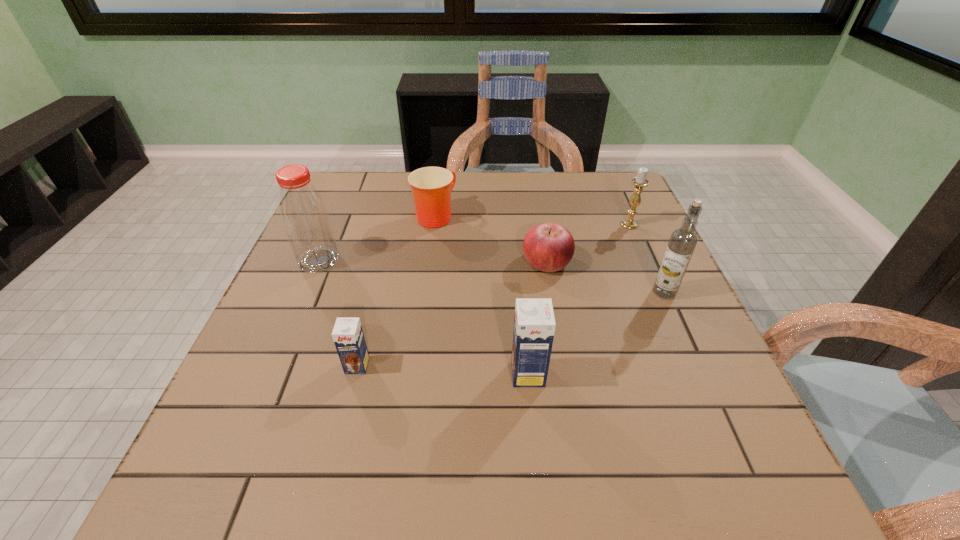
Identify the location of free space located on the front label of the right chocolate milk. (395, 374).

This screenshot has width=960, height=540. In order to click on blank space located 0.290m on the front label of the right chocolate milk in this screenshot , I will do `click(357, 374)`.

I want to click on vacant position located on the right of the fifth object from right to left, so click(536, 215).

The image size is (960, 540). I want to click on vacant space located on the back of the candle holder, so (619, 201).

The width and height of the screenshot is (960, 540). I want to click on free location located on the right of the bottle, so click(x=364, y=260).

Image resolution: width=960 pixels, height=540 pixels. What are the coordinates of `free space located 0.140m on the left of the apple` in the screenshot? It's located at pos(464,262).

Where is `free space located 0.320m on the label of the fifth farthest object`? The height and width of the screenshot is (540, 960). free space located 0.320m on the label of the fifth farthest object is located at coordinates (510, 293).

What are the coordinates of `free space located 0.380m on the label of the fifth farthest object` in the screenshot? It's located at point(483,293).

Where is `free spot located 0.180m on the label of the fifth farthest object`? free spot located 0.180m on the label of the fifth farthest object is located at coordinates (572, 293).

Find the location of a particular element. The width and height of the screenshot is (960, 540). object that is at the far edge is located at coordinates (431, 187).